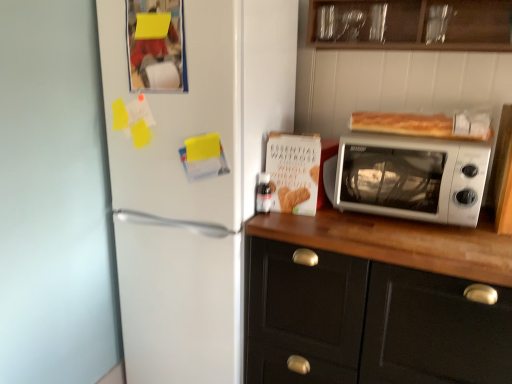
Find the location of `golden brown crusty bread at upper right`. golden brown crusty bread at upper right is located at coordinates (424, 124).

Measure the distance between point (454, 183) and camera.

The depth of point (454, 183) is 1.34 meters.

At what (x,y) coordinates should I click in order to perform the action: click on white matte refrigerator at left. Please return your answer as a coordinate pair (x, y). The height and width of the screenshot is (384, 512). Looking at the image, I should click on (192, 180).

In order to face white matte cabinet at right, arranged as the 2th cabinetry when viewed from the top, should I rotate leftwards or rightwards?

Rotate your view right by about 17.503°.

Locate an element on the screen. golden brown crusty bread at upper right is located at coordinates (424, 124).

Is white matte cabinet at right, positioned as the 1th cabinetry in bottom-to-top order, positioned with its back to golden brown crusty bread at upper right?

white matte cabinet at right, positioned as the 1th cabinetry in bottom-to-top order, is not turned away from golden brown crusty bread at upper right.

Consider the image. From the image's perspective, which one is positioned lower, white matte cabinet at right, positioned as the 1th cabinetry in bottom-to-top order, or golden brown crusty bread at upper right?

white matte cabinet at right, positioned as the 1th cabinetry in bottom-to-top order, appears lower in the image.

Are white matte cabinet at right, arranged as the 2th cabinetry when viewed from the top, and golden brown crusty bread at upper right beside each other?

white matte cabinet at right, arranged as the 2th cabinetry when viewed from the top, and golden brown crusty bread at upper right are not in contact.

Is white plastic microwave at upper right oriented away from golden brown crusty bread at upper right?

No.

Is there a large distance between white plastic microwave at upper right and golden brown crusty bread at upper right?

No, white plastic microwave at upper right is in close proximity to golden brown crusty bread at upper right.

Is white plastic microwave at upper right located outside golden brown crusty bread at upper right?

Absolutely, white plastic microwave at upper right is external to golden brown crusty bread at upper right.

In terms of width, does white plastic microwave at upper right look wider or thinner when compared to golden brown crusty bread at upper right?

Clearly, white plastic microwave at upper right has more width compared to golden brown crusty bread at upper right.

Are golden brown crusty bread at upper right and white matte refrigerator at left making contact?

golden brown crusty bread at upper right and white matte refrigerator at left are not in contact.

Is white matte refrigerator at left at the back of golden brown crusty bread at upper right?

No, golden brown crusty bread at upper right's orientation is not away from white matte refrigerator at left.

Consider the image. Is golden brown crusty bread at upper right outside of white matte refrigerator at left?

Absolutely, golden brown crusty bread at upper right is external to white matte refrigerator at left.

From the image's perspective, between golden brown crusty bread at upper right and white matte refrigerator at left, who is located below?

white matte refrigerator at left appears lower in the image.

Who is more distant, white matte refrigerator at left or wooden cabinet at upper center, the first cabinetry when ordered from top to bottom?

wooden cabinet at upper center, the first cabinetry when ordered from top to bottom, is more distant.

Is white matte refrigerator at left situated inside wooden cabinet at upper center, the first cabinetry when ordered from top to bottom, or outside?

The correct answer is: outside.

In the scene shown: From a real-world perspective, is white matte refrigerator at left above or below wooden cabinet at upper center, arranged as the second cabinetry when ordered from the bottom?

white matte refrigerator at left is situated lower than wooden cabinet at upper center, arranged as the second cabinetry when ordered from the bottom, in the real world.

Considering the relative sizes of white matte refrigerator at left and wooden cabinet at upper center, arranged as the second cabinetry when ordered from the bottom, in the image provided, is white matte refrigerator at left thinner than wooden cabinet at upper center, arranged as the second cabinetry when ordered from the bottom,?

No, white matte refrigerator at left is not thinner than wooden cabinet at upper center, arranged as the second cabinetry when ordered from the bottom.

Image resolution: width=512 pixels, height=384 pixels. There is a white plastic microwave at upper right. Identify the location of food above it (from a real-world perspective). (424, 124).

Considering the sizes of objects golden brown crusty bread at upper right and white plastic microwave at upper right in the image provided, who is smaller, golden brown crusty bread at upper right or white plastic microwave at upper right?

Smaller between the two is golden brown crusty bread at upper right.

Does golden brown crusty bread at upper right touch white plastic microwave at upper right?

golden brown crusty bread at upper right is not next to white plastic microwave at upper right, and they're not touching.

From a real-world perspective, who is located lower, golden brown crusty bread at upper right or white plastic microwave at upper right?

From a 3D spatial view, white plastic microwave at upper right is below.

Could you tell me if wooden cabinet at upper center, the first cabinetry when ordered from top to bottom, is facing golden brown crusty bread at upper right?

No, wooden cabinet at upper center, the first cabinetry when ordered from top to bottom, is not turned towards golden brown crusty bread at upper right.

Is point (323, 34) positioned before point (471, 129)?

No.

Relative to golden brown crusty bread at upper right, is wooden cabinet at upper center, arranged as the second cabinetry when ordered from the bottom, in front or behind?

Visually, wooden cabinet at upper center, arranged as the second cabinetry when ordered from the bottom, is located in front of golden brown crusty bread at upper right.

Is golden brown crusty bread at upper right closer to the viewer compared to white matte cabinet at right, arranged as the 2th cabinetry when viewed from the top?

No.

From the image's perspective, is golden brown crusty bread at upper right above or below white matte cabinet at right, arranged as the 2th cabinetry when viewed from the top?

golden brown crusty bread at upper right is situated higher than white matte cabinet at right, arranged as the 2th cabinetry when viewed from the top, in the image.

Between golden brown crusty bread at upper right and white matte cabinet at right, positioned as the 1th cabinetry in bottom-to-top order, which one has smaller width?

Thinner between the two is golden brown crusty bread at upper right.

Is white matte cabinet at right, positioned as the 1th cabinetry in bottom-to-top order, surrounded by golden brown crusty bread at upper right?

No, white matte cabinet at right, positioned as the 1th cabinetry in bottom-to-top order, is not inside golden brown crusty bread at upper right.

The width and height of the screenshot is (512, 384). In order to click on food on the right of white matte cabinet at right, arranged as the 2th cabinetry when viewed from the top in this screenshot , I will do `click(424, 124)`.

This screenshot has width=512, height=384. I want to click on food behind the white plastic microwave at upper right, so click(424, 124).

Looking at the image, which one is located further to wooden cabinet at upper center, arranged as the second cabinetry when ordered from the bottom, white matte refrigerator at left or white matte cabinet at right, arranged as the 2th cabinetry when viewed from the top?

white matte cabinet at right, arranged as the 2th cabinetry when viewed from the top, is positioned further to the anchor wooden cabinet at upper center, arranged as the second cabinetry when ordered from the bottom.

Based on the photo, looking at the image, which one is located closer to white plastic microwave at upper right, wooden cabinet at upper center, arranged as the second cabinetry when ordered from the bottom, or golden brown crusty bread at upper right?

golden brown crusty bread at upper right is positioned closer to the anchor white plastic microwave at upper right.

Considering their positions, is white matte cabinet at right, arranged as the 2th cabinetry when viewed from the top, positioned further to white matte refrigerator at left than golden brown crusty bread at upper right?

The object further to white matte refrigerator at left is golden brown crusty bread at upper right.

Considering their positions, is white plastic microwave at upper right positioned closer to white matte refrigerator at left than golden brown crusty bread at upper right?

white plastic microwave at upper right.

Based on their spatial positions, is white matte cabinet at right, arranged as the 2th cabinetry when viewed from the top, or white matte refrigerator at left further from white plastic microwave at upper right?

white matte refrigerator at left lies further to white plastic microwave at upper right than the other object.

In the scene shown: From the image, which object appears to be farther from white matte cabinet at right, positioned as the 1th cabinetry in bottom-to-top order, wooden cabinet at upper center, the first cabinetry when ordered from top to bottom, or white matte refrigerator at left?

The object further to white matte cabinet at right, positioned as the 1th cabinetry in bottom-to-top order, is wooden cabinet at upper center, the first cabinetry when ordered from top to bottom.

Looking at the image, which one is located closer to white matte refrigerator at left, golden brown crusty bread at upper right or white plastic microwave at upper right?

Based on the image, white plastic microwave at upper right appears to be nearer to white matte refrigerator at left.

Considering their positions, is white matte refrigerator at left positioned closer to wooden cabinet at upper center, the first cabinetry when ordered from top to bottom, than white plastic microwave at upper right?

Among the two, white plastic microwave at upper right is located nearer to wooden cabinet at upper center, the first cabinetry when ordered from top to bottom.

The width and height of the screenshot is (512, 384). In order to click on microwave oven between wooden cabinet at upper center, arranged as the second cabinetry when ordered from the bottom, and white matte cabinet at right, positioned as the 1th cabinetry in bottom-to-top order, in the vertical direction in this screenshot , I will do `click(409, 177)`.

This screenshot has height=384, width=512. Identify the location of refrigerator between wooden cabinet at upper center, arranged as the second cabinetry when ordered from the bottom, and white matte cabinet at right, arranged as the 2th cabinetry when viewed from the top, vertically. (192, 180).

Find the location of a particular element. microwave oven between golden brown crusty bread at upper right and white matte cabinet at right, positioned as the 1th cabinetry in bottom-to-top order, vertically is located at coordinates (409, 177).

Where is `food between wooden cabinet at upper center, the first cabinetry when ordered from top to bottom, and white plastic microwave at upper right vertically`? Image resolution: width=512 pixels, height=384 pixels. food between wooden cabinet at upper center, the first cabinetry when ordered from top to bottom, and white plastic microwave at upper right vertically is located at coordinates (424, 124).